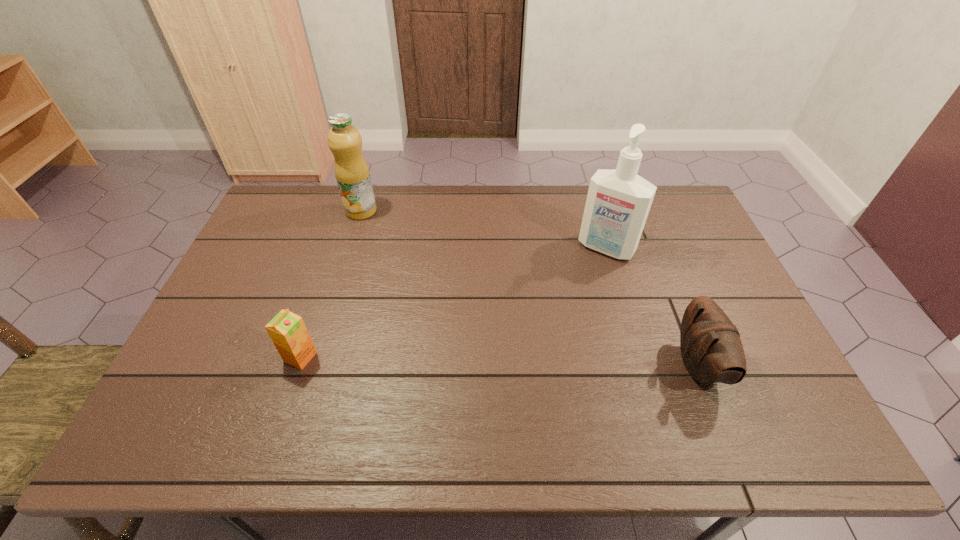
Locate an element on the screen. This screenshot has width=960, height=540. orange juice is located at coordinates 287,330.

Identify the location of the rightmost object. Image resolution: width=960 pixels, height=540 pixels. (712, 352).

In order to click on the farthest object in this screenshot , I will do `click(351, 170)`.

Where is `the second tallest object`? the second tallest object is located at coordinates (351, 170).

This screenshot has width=960, height=540. I want to click on cleansing agent, so click(618, 202).

This screenshot has height=540, width=960. In order to click on the second object from right to left in this screenshot , I will do `click(618, 202)`.

Locate an element on the screen. This screenshot has width=960, height=540. blank space located 0.370m on the back of the orange juice is located at coordinates (337, 249).

The width and height of the screenshot is (960, 540). I want to click on vacant region located 0.070m with the flap open on the rightmost object, so click(x=748, y=365).

Find the location of a particular element. The image size is (960, 540). vacant space situated 0.150m on the front label of the farthest object is located at coordinates (381, 245).

Identify the location of free point located 0.390m on the front label of the farthest object. (409, 294).